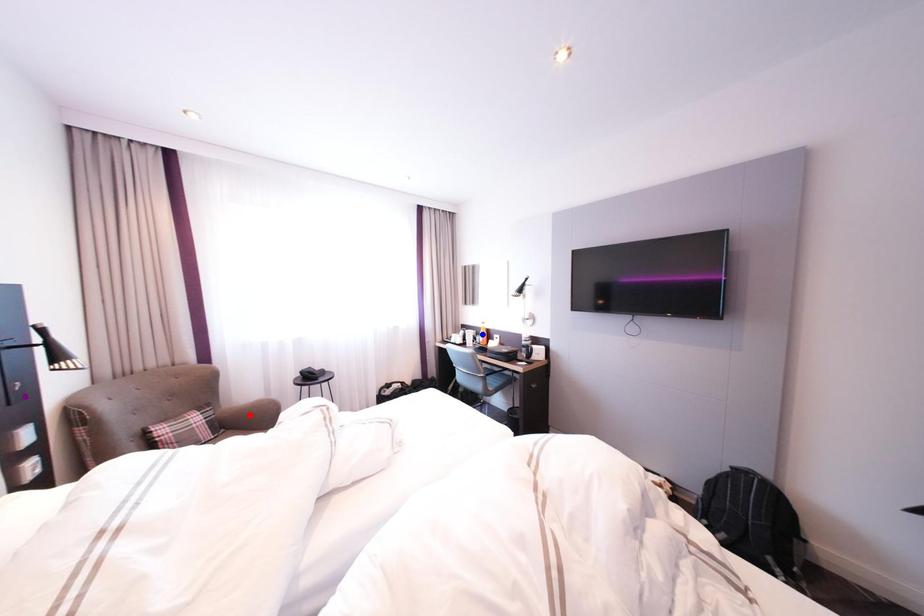
Order these from nearest to farthest:
blue point | red point | purple point

blue point → red point → purple point